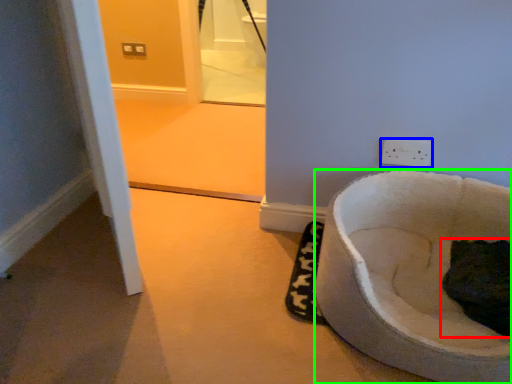
Question: Which object is the farthest from cat (highlighted by a red box)? Choose among these: power plugs and sockets (highlighted by a blue box) or toilet (highlighted by a green box).

Choices:
 (A) power plugs and sockets
 (B) toilet

Answer: (A)